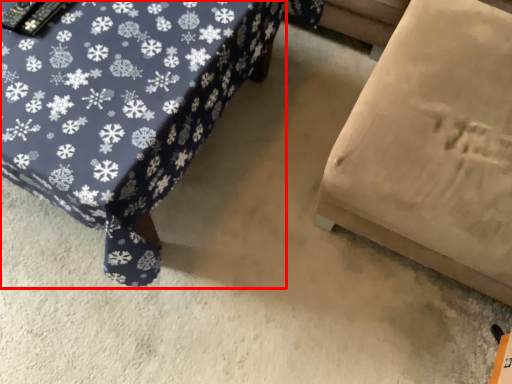
Question: Observing the image, what is the correct spatial positioning of furniture (annotated by the red box) in reference to furniture?

Choices:
 (A) left
 (B) right

Answer: (A)